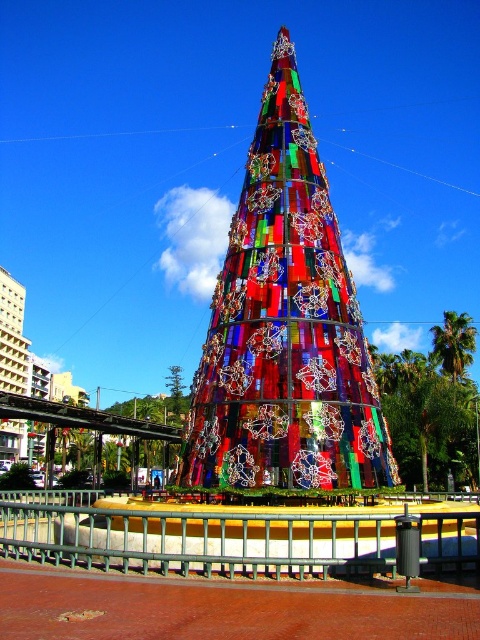
You are standing in the public square and see the stained glass tree at center and the stained glass christmas tree at center. Which one is positioned higher?

The stained glass tree at center is positioned higher than the stained glass christmas tree at center.

You are an event planner setting up a photo booth near the stained glass tree at center and the stained glass christmas tree at center. Which of the two trees has a narrower width?

The stained glass tree at center has a lesser width compared to the stained glass christmas tree at center, so the stained glass tree at center is narrower.

In the scene shown: You are standing in the public square and see both the stained glass tree at center and the stained glass christmas tree at center. Which one is closer to you?

The stained glass tree at center is closer to the viewer than the stained glass christmas tree at center.